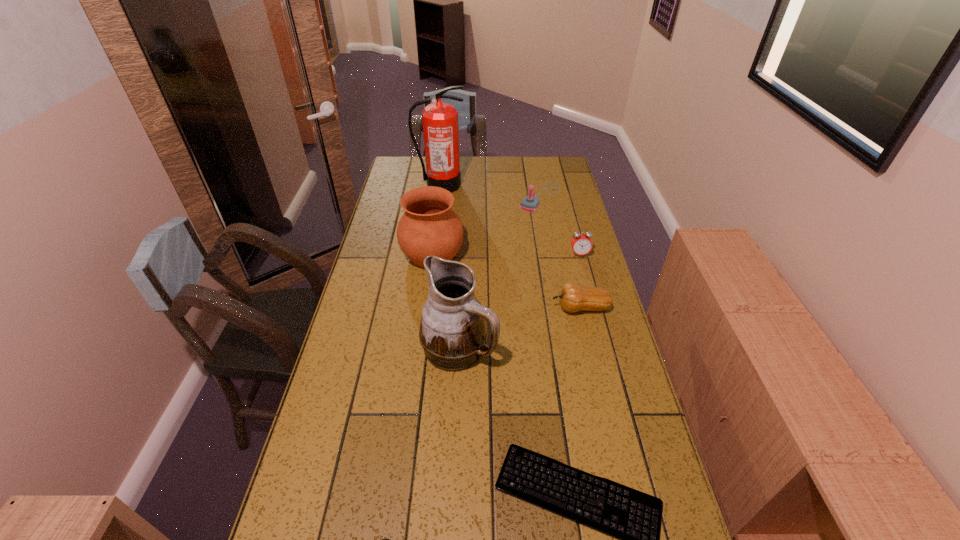
Find the location of a particular element. alarm clock present at the right edge is located at coordinates (581, 244).

This screenshot has width=960, height=540. What are the coordinates of `object that is at the far left corner` in the screenshot? It's located at (440, 120).

Locate an element on the screen. The width and height of the screenshot is (960, 540). free space at the far edge is located at coordinates (469, 161).

Locate an element on the screen. The image size is (960, 540). vacant position at the left edge of the desktop is located at coordinates (377, 282).

Locate an element on the screen. This screenshot has height=540, width=960. vacant area at the right edge of the desktop is located at coordinates (660, 480).

The image size is (960, 540). In the image, there is a desktop. Identify the location of vacant space at the far left corner. (403, 179).

The image size is (960, 540). In the image, there is a desktop. What are the coordinates of `free space at the far right corner` in the screenshot? It's located at (561, 164).

The image size is (960, 540). I want to click on empty space between the pitcher and the gourd, so click(x=519, y=328).

You are a GUI agent. You are given a task and a screenshot of the screen. Output one action in this format:
    pyautogui.click(x=<x>, y=<y>)
    Task: Click on the unoccupied area between the gourd and the tallest object
    
    Given the screenshot: What is the action you would take?
    pyautogui.click(x=511, y=247)

Where is `vacant point located between the joystick and the third tallest object`? vacant point located between the joystick and the third tallest object is located at coordinates (487, 226).